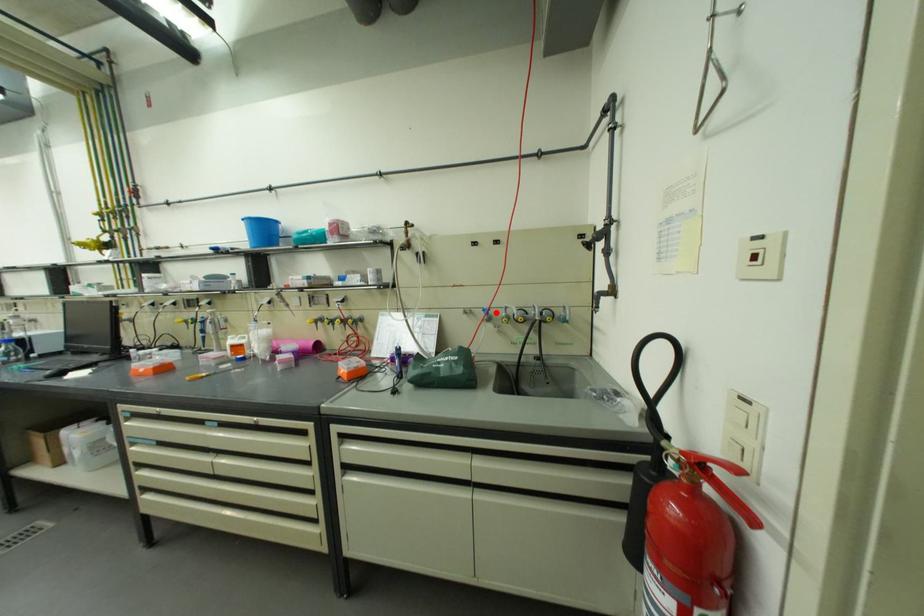
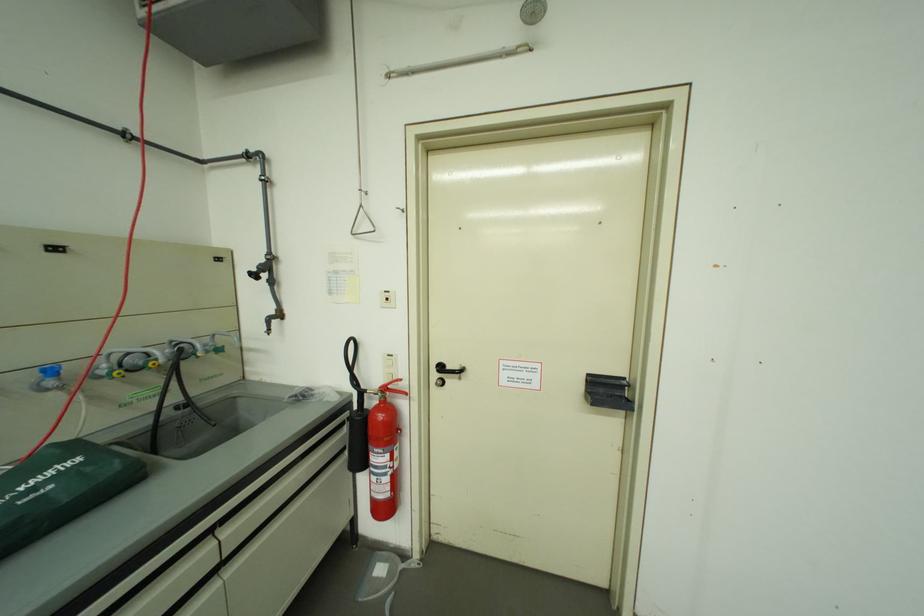
Find the pixel in the second image that matches the highlighted location in the first image.

(62, 373)